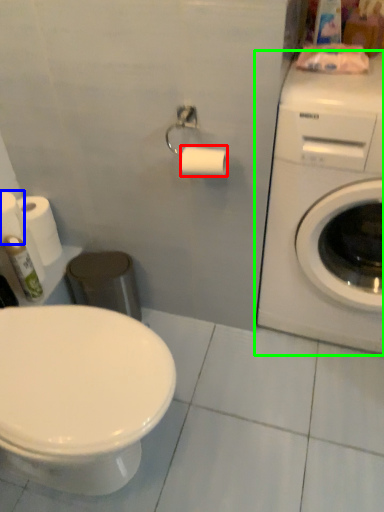
Question: Which object is the farthest from toilet paper (highlighted by a red box)? Choose among these: toilet paper (highlighted by a blue box) or washing machine (highlighted by a green box).

Choices:
 (A) toilet paper
 (B) washing machine

Answer: (A)